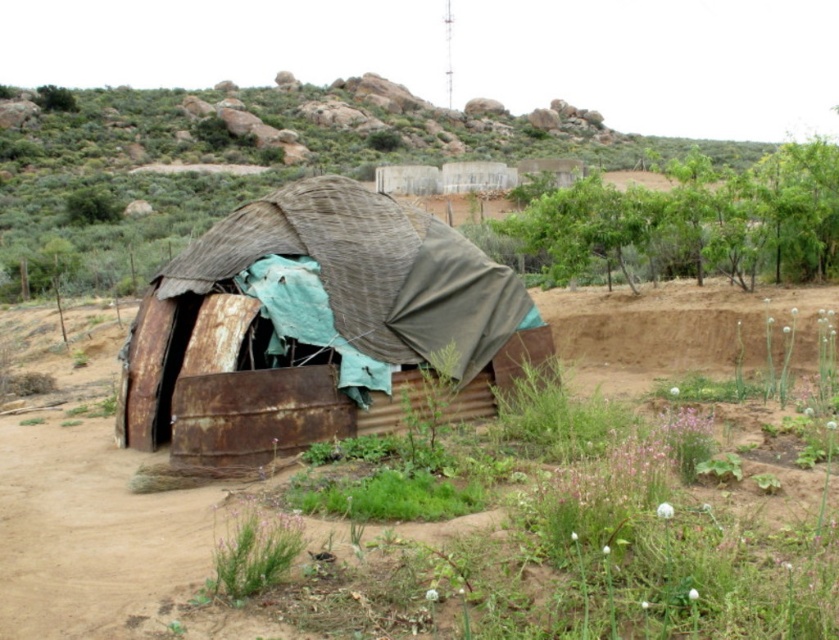
Which of these two, rusty corrugated metal hut at center or green leafy plants at upper right, stands taller?

Standing taller between the two is green leafy plants at upper right.

The height and width of the screenshot is (640, 839). Find the location of `rusty corrugated metal hut at center`. rusty corrugated metal hut at center is located at coordinates (316, 330).

Locate an element on the screen. rusty corrugated metal hut at center is located at coordinates (316, 330).